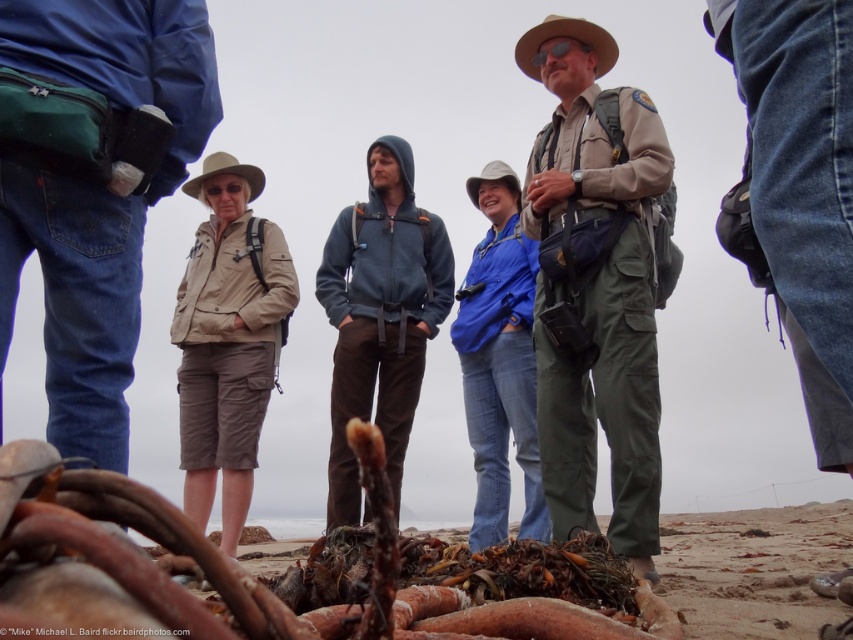
You are a photographer trying to capture a clear shot of the khaki uniform at center without the brown organic debris at lower center blocking the view. Based on their positions, can you position yourself in a way to avoid the debris?

The brown organic debris at lower center is positioned on the left side of the khaki uniform at center. To avoid the debris, position yourself to the right side of the khaki uniform at center so that the debris is out of frame or obscured.

You are a photographer trying to capture a clear shot of the matte blue hoodie at center and the white fabric cowboy hat at center. Based on their positions, which object should you focus on first to ensure both are in frame?

The matte blue hoodie at center is below the white fabric cowboy hat at center, so you should focus on the white fabric cowboy hat at center first to ensure both are in frame.

You are a fashion designer observing the beach scene. You notice the matte blue hoodie at center and the blue denim jeans at center. Which clothing item appears shorter in the image?

The matte blue hoodie at center has a lesser height compared to the blue denim jeans at center, so the matte blue hoodie at center appears shorter.